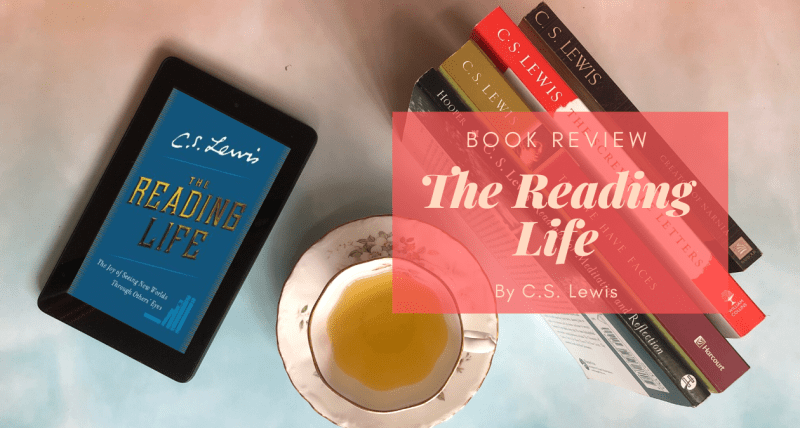
The width and height of the screenshot is (800, 428). What are the coordinates of `teacup handle` in the screenshot? It's located at (482, 343).